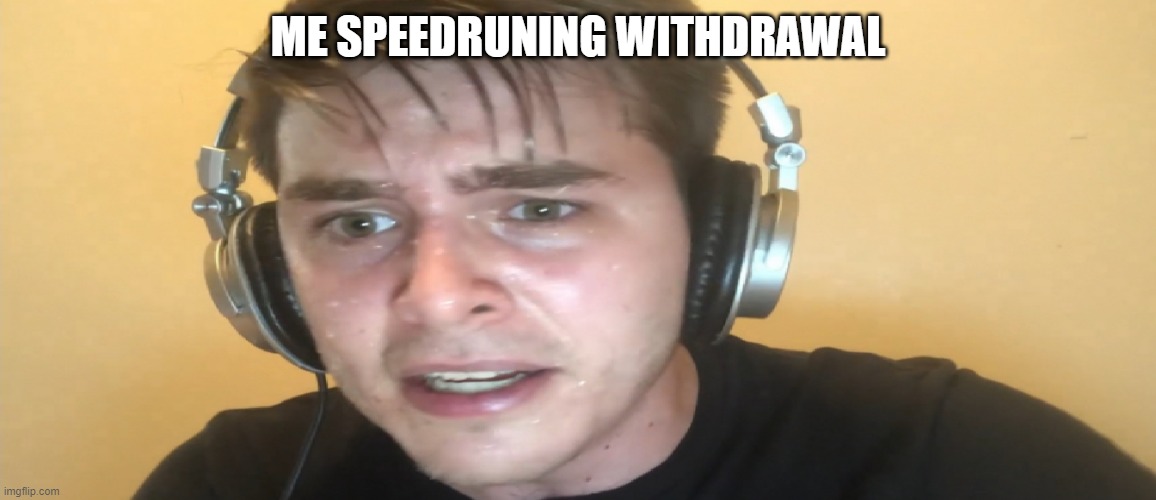
Where is `cushion`? cushion is located at coordinates (275, 260).